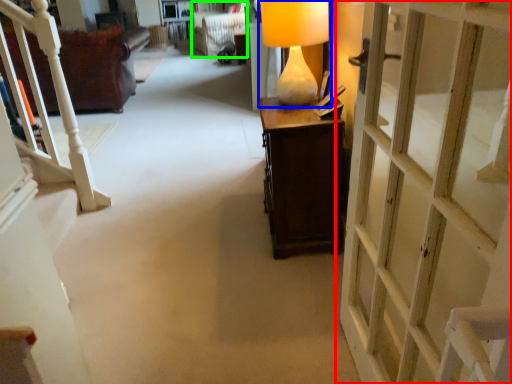
Question: Based on their relative distances, which object is nearer to door (highlighted by a red box)? Choose from table lamp (highlighted by a blue box) and armchair (highlighted by a green box).

Choices:
 (A) table lamp
 (B) armchair

Answer: (A)